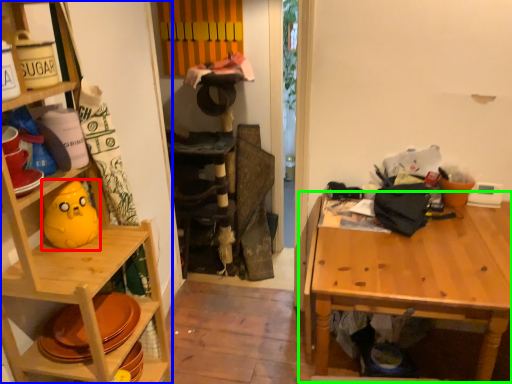
Question: Which object is the closest to the toy (highlighted by a red box)? Choose among these: shelf (highlighted by a blue box) or table (highlighted by a green box).

Choices:
 (A) shelf
 (B) table

Answer: (A)